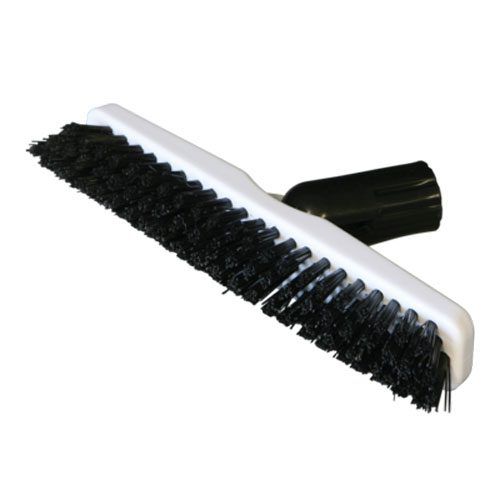
This screenshot has width=500, height=500. I want to click on left corner, so click(x=467, y=479).